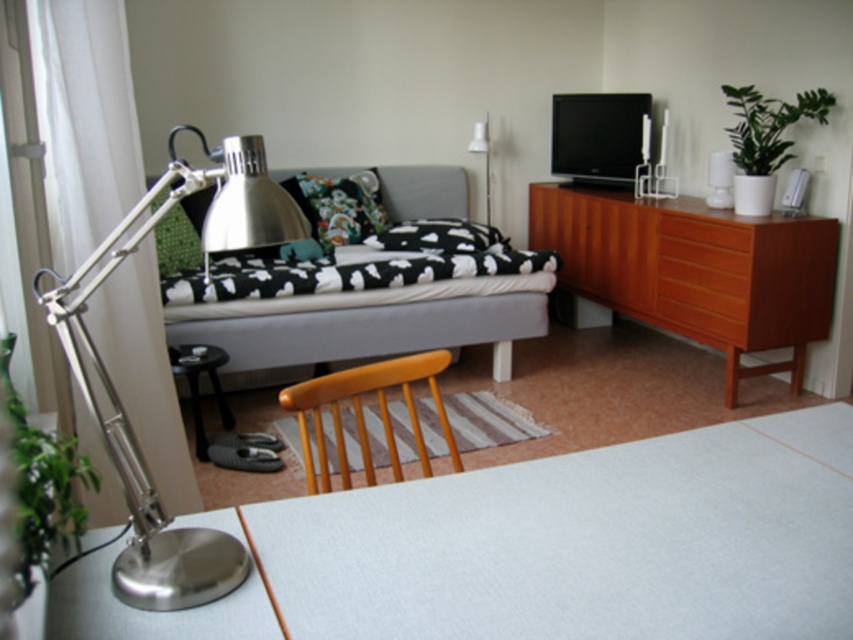
Question: Which point appears closest to the camera in this image?

Choices:
 (A) (508, 554)
 (B) (53, 250)
 (C) (431, 396)

Answer: (A)

Question: From the image, what is the correct spatial relationship of teak wood dresser at right in relation to silver/metallic desk lamp at left?

Choices:
 (A) left
 (B) right

Answer: (B)

Question: Which point is farther from the camera taking this photo?

Choices:
 (A) (665, 534)
 (B) (706, 262)

Answer: (B)

Question: Is teak wood dresser at right thinner than floral fabric pillow at center?

Choices:
 (A) yes
 (B) no

Answer: (B)

Question: Is black cotton pillow at center further to the viewer compared to black glossy table at lower left?

Choices:
 (A) no
 (B) yes

Answer: (B)

Question: Which of the following is the closest to the observer?

Choices:
 (A) black glossy table at lower left
 (B) black matte bed at center

Answer: (A)